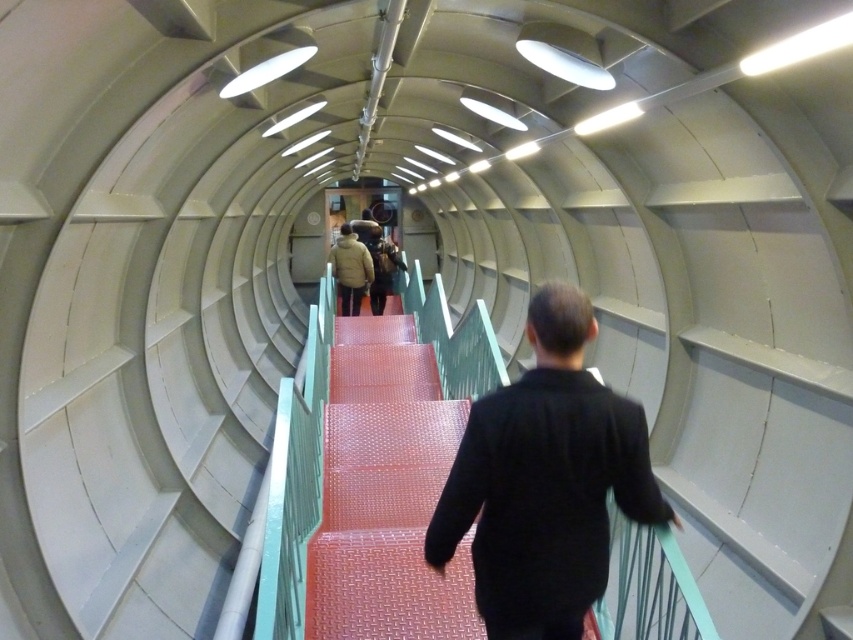
Question: Is black matte jacket at center wider than red textured stairs at center?

Choices:
 (A) yes
 (B) no

Answer: (B)

Question: Is red textured stairs at center in front of matte brown jacket at center?

Choices:
 (A) no
 (B) yes

Answer: (B)

Question: Which point is closer to the camera?

Choices:
 (A) black matte jacket at center
 (B) red textured stairs at center
 (C) matte brown jacket at center

Answer: (A)

Question: Which point appears closest to the camera in this image?

Choices:
 (A) (352, 260)
 (B) (618, 472)

Answer: (B)

Question: Is black matte jacket at center positioned at the back of red textured stairs at center?

Choices:
 (A) no
 (B) yes

Answer: (A)

Question: Which point is closer to the camera?

Choices:
 (A) black matte jacket at center
 (B) red textured stairs at center

Answer: (A)